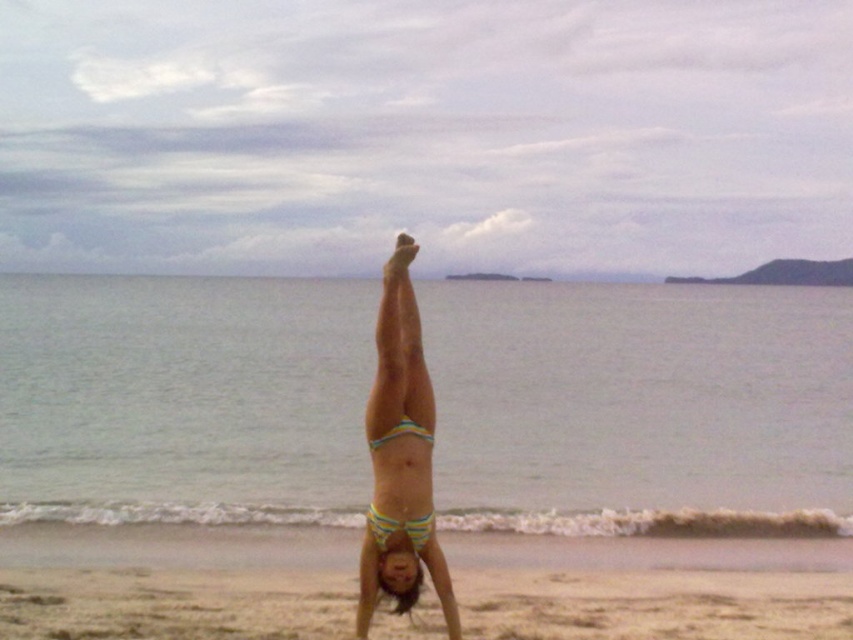
Question: Does beige sandy beach at lower center have a lesser width compared to striped fabric bikini at center?

Choices:
 (A) no
 (B) yes

Answer: (A)

Question: Does yellow striped bikini at center come behind striped fabric bikini at center?

Choices:
 (A) yes
 (B) no

Answer: (B)

Question: Which object appears farthest from the camera in this image?

Choices:
 (A) beige sandy beach at lower center
 (B) striped fabric bikini at center
 (C) striped bikini at center

Answer: (A)

Question: Is striped bikini at center thinner than yellow striped bikini at center?

Choices:
 (A) yes
 (B) no

Answer: (B)

Question: Estimate the real-world distances between objects in this image. Which object is farther from the yellow striped bikini at center?

Choices:
 (A) beige sandy beach at lower center
 (B) striped bikini at center

Answer: (A)

Question: Which of the following is the closest to the observer?

Choices:
 (A) (366, 522)
 (B) (430, 518)
 (C) (402, 422)

Answer: (B)